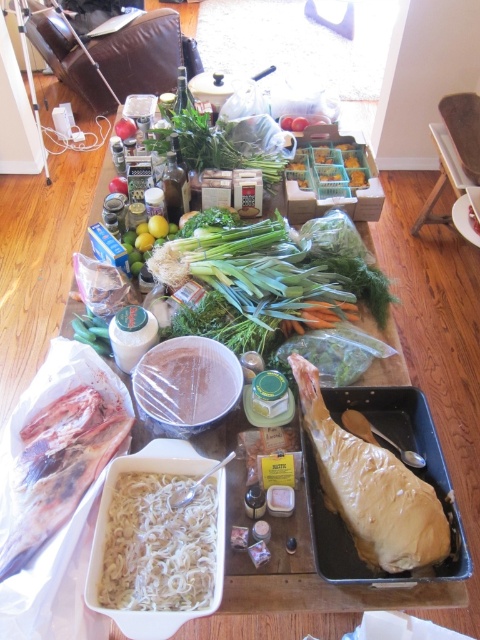
This screenshot has height=640, width=480. I want to click on golden brown parchment paper wrapped meat at center, so click(x=371, y=488).

Which is behind, point (405, 561) or point (175, 588)?

The point (405, 561) is more distant.

Based on the photo, who is more forward, (337, 438) or (146, 608)?

Positioned in front is point (146, 608).

At what (x,y) coordinates should I click in order to perform the action: click on golden brown parchment paper wrapped meat at center. Please return your answer as a coordinate pair (x, y). Image resolution: width=480 pixels, height=640 pixels. Looking at the image, I should click on (371, 488).

Does golden brown parchment paper wrapped meat at center lie behind green leafy at center?

No, it is in front of green leafy at center.

Which is in front, point (408, 490) or point (95, 333)?

Point (408, 490) is more forward.

The width and height of the screenshot is (480, 640). What are the coordinates of `golden brown parchment paper wrapped meat at center` in the screenshot? It's located at click(x=371, y=488).

Which is below, frozen pinkish meat at lower left or green leafy at center?

frozen pinkish meat at lower left

Does frozen pinkish meat at lower left lie behind green leafy at center?

No.

Find the location of a particular element. The width and height of the screenshot is (480, 640). frozen pinkish meat at lower left is located at coordinates (60, 467).

Where is `frozen pinkish meat at lower left`? frozen pinkish meat at lower left is located at coordinates (60, 467).